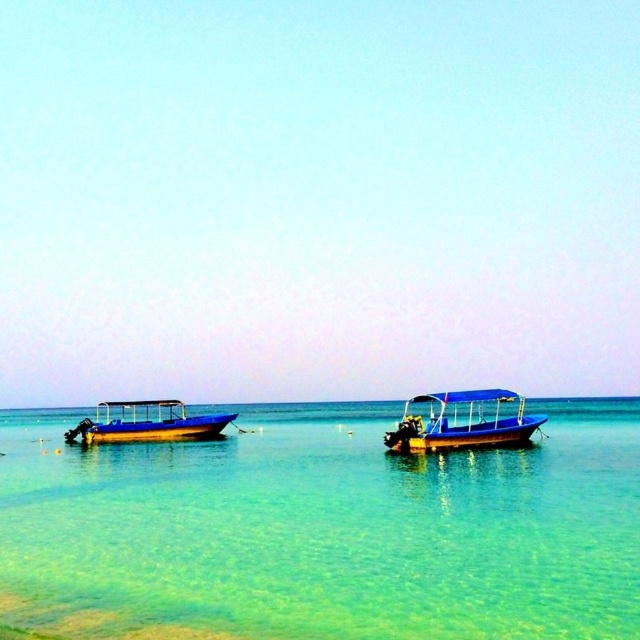
Question: Can you confirm if clear water at center is wider than blue plastic boat at center?

Choices:
 (A) yes
 (B) no

Answer: (A)

Question: Which object appears farthest from the camera in this image?

Choices:
 (A) blue plastic boat at center
 (B) blue glossy boat at left
 (C) clear water at center

Answer: (B)

Question: Estimate the real-world distances between objects in this image. Which object is farther from the blue plastic boat at center?

Choices:
 (A) blue glossy boat at left
 (B) clear water at center

Answer: (B)

Question: Which of the following is the closest to the observer?

Choices:
 (A) blue glossy boat at left
 (B) blue plastic boat at center
 (C) clear water at center

Answer: (C)

Question: Is clear water at center further to camera compared to blue plastic boat at center?

Choices:
 (A) no
 (B) yes

Answer: (A)

Question: Does blue plastic boat at center appear under blue glossy boat at left?

Choices:
 (A) no
 (B) yes

Answer: (A)